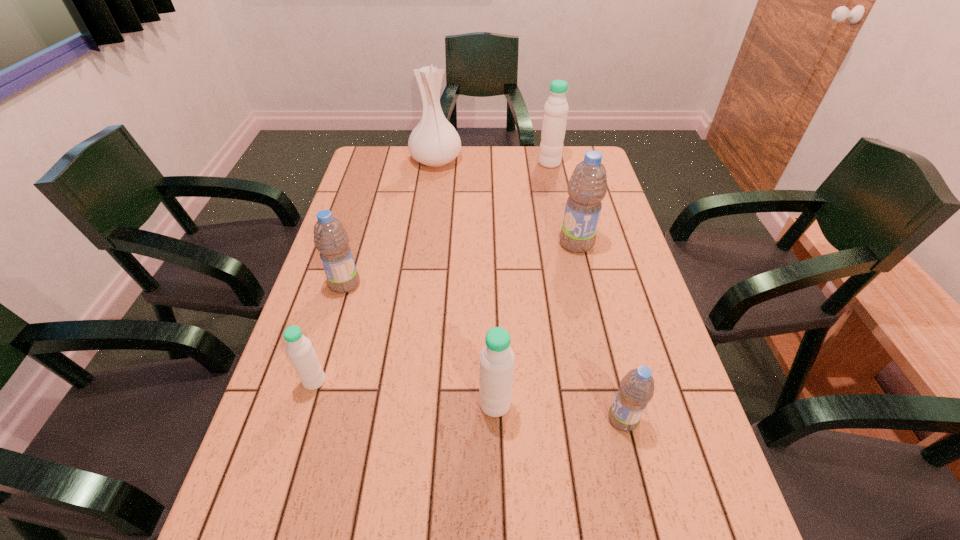
Identify which blue water bottle is the second closest to the fourth object from right to left. Please provide its 2D coordinates. Your answer should be formatted as a tuple, i.e. [(x, y)], where the tuple contains the x and y coordinates of a point satisfying the conditions above.

[(330, 237)]

Where is `blue water bottle object that ranks as the closest to the second biggest blue water bottle`? The height and width of the screenshot is (540, 960). blue water bottle object that ranks as the closest to the second biggest blue water bottle is located at coordinates (587, 187).

Find the location of a particular element. The height and width of the screenshot is (540, 960). free space that satisfies the following two spatial constraints: 1. on the front side of the nearest blue water bottle; 2. on the left side of the second farthest blue water bottle is located at coordinates (304, 419).

Find the location of a particular element. vacant space that satisfies the following two spatial constraints: 1. on the front side of the vase; 2. on the left side of the second biggest white water bottle is located at coordinates point(403,404).

At what (x,y) coordinates should I click in order to perform the action: click on free space that satisfies the following two spatial constraints: 1. on the back side of the rightmost white water bottle; 2. on the right side of the second smallest blue water bottle. Please return your answer as a coordinate pair (x, y). Looking at the image, I should click on (381, 163).